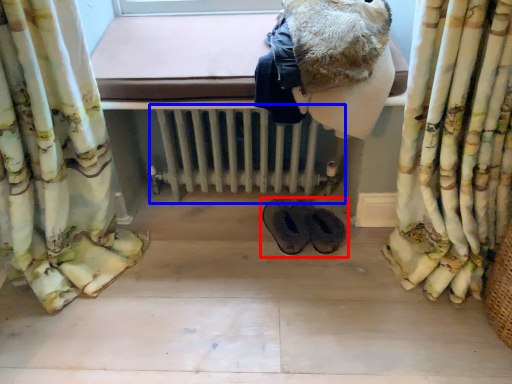
Question: Which object appears closest to the camera in this image, footwear (highlighted by a red box) or radiator (highlighted by a blue box)?

Choices:
 (A) footwear
 (B) radiator

Answer: (B)